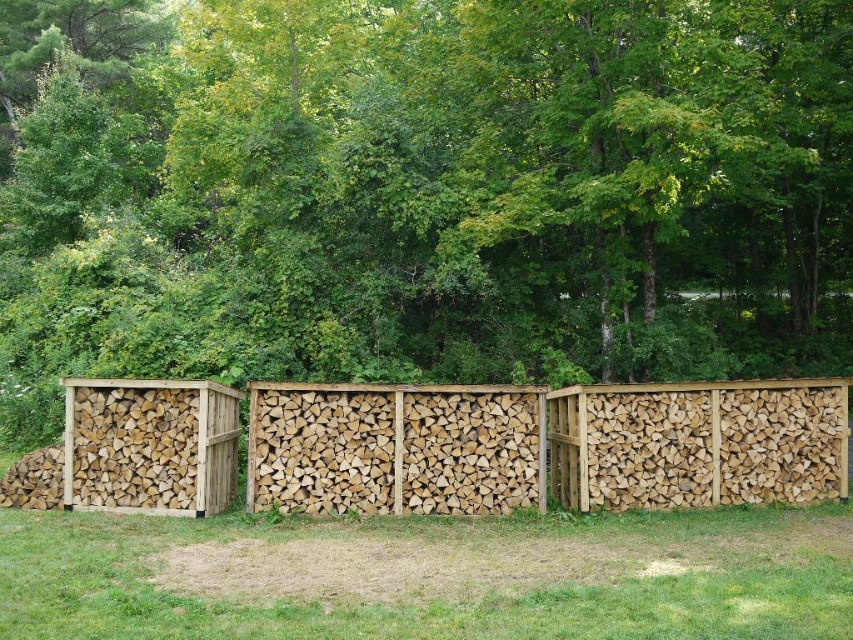
Question: Does natural green leaves at center lie in front of green grass at lower center?

Choices:
 (A) no
 (B) yes

Answer: (A)

Question: Which object appears closest to the camera in this image?

Choices:
 (A) green grass at lower center
 (B) natural wood fence at center

Answer: (A)

Question: Among these points, which one is farthest from the camera?

Choices:
 (A) (244, 634)
 (B) (495, 164)
 (C) (276, 400)

Answer: (B)

Question: Which point appears closest to the camera in this image?

Choices:
 (A) (712, 481)
 (B) (32, 592)
 (C) (267, 241)

Answer: (B)

Question: Does natural green leaves at center have a lesser width compared to natural wood fence at center?

Choices:
 (A) yes
 (B) no

Answer: (B)

Question: Observing the image, what is the correct spatial positioning of green grass at lower center in reference to natural wood fence at center?

Choices:
 (A) left
 (B) right

Answer: (B)